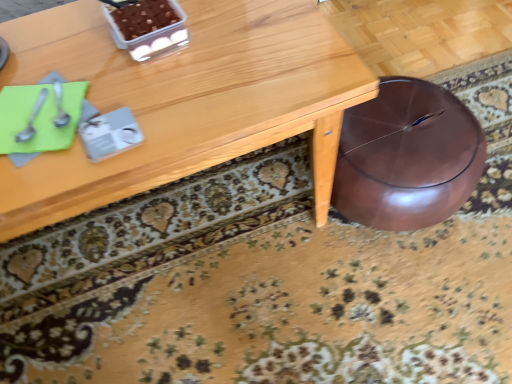
Describe the element at coordinates (183, 100) in the screenshot. I see `glossy wood table at center` at that location.

Measure the distance between glossy wood table at center and camera.

The distance of glossy wood table at center from camera is 26.47 inches.

In order to face glossy wood table at center, should I rotate leftwards or rightwards?

You should look left and rotate roughly 16.256 degrees.

The height and width of the screenshot is (384, 512). I want to click on glossy wood table at center, so click(183, 100).

This screenshot has width=512, height=384. In order to click on glossy wood table at center in this screenshot , I will do pyautogui.click(x=183, y=100).